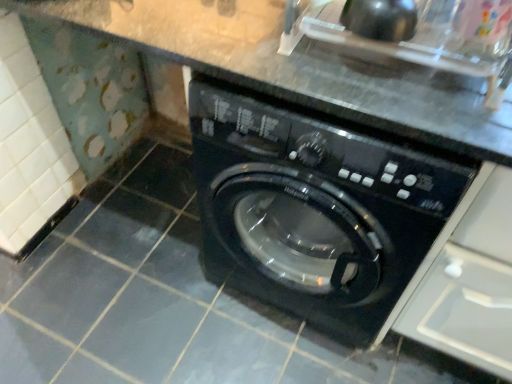
Question: From the image's perspective, is white plastic drawer at upper right beneath black glossy sink at upper right?

Choices:
 (A) yes
 (B) no

Answer: (A)

Question: Does white plastic drawer at upper right have a greater width compared to black glossy sink at upper right?

Choices:
 (A) yes
 (B) no

Answer: (A)

Question: Does white plastic drawer at upper right have a lesser height compared to black glossy sink at upper right?

Choices:
 (A) no
 (B) yes

Answer: (A)

Question: From a real-world perspective, is white plastic drawer at upper right positioned under black glossy sink at upper right based on gravity?

Choices:
 (A) no
 (B) yes

Answer: (B)

Question: Considering the relative sizes of white plastic drawer at upper right and black glossy sink at upper right in the image provided, is white plastic drawer at upper right thinner than black glossy sink at upper right?

Choices:
 (A) no
 (B) yes

Answer: (A)

Question: Considering the positions of point (225, 119) and point (464, 288), is point (225, 119) closer or farther from the camera than point (464, 288)?

Choices:
 (A) farther
 (B) closer

Answer: (B)

Question: From the image's perspective, is black glossy washing machine at center positioned above or below white plastic drawer at upper right?

Choices:
 (A) above
 (B) below

Answer: (A)

Question: Looking at their shapes, would you say black glossy washing machine at center is wider or thinner than white plastic drawer at upper right?

Choices:
 (A) wide
 (B) thin

Answer: (A)

Question: In terms of height, does black glossy washing machine at center look taller or shorter compared to white plastic drawer at upper right?

Choices:
 (A) tall
 (B) short

Answer: (B)

Question: Do you think black glossy washing machine at center is within black glossy sink at upper right, or outside of it?

Choices:
 (A) outside
 (B) inside

Answer: (A)

Question: Considering the relative positions of black glossy washing machine at center and black glossy sink at upper right in the image provided, is black glossy washing machine at center to the left or to the right of black glossy sink at upper right?

Choices:
 (A) right
 (B) left

Answer: (B)

Question: In terms of size, does black glossy washing machine at center appear bigger or smaller than black glossy sink at upper right?

Choices:
 (A) big
 (B) small

Answer: (A)

Question: From the image's perspective, is black glossy washing machine at center positioned above or below black glossy sink at upper right?

Choices:
 (A) above
 (B) below

Answer: (B)

Question: In the image, is black glossy sink at upper right on the left side or the right side of white plastic drawer at upper right?

Choices:
 (A) left
 (B) right

Answer: (A)

Question: Is black glossy sink at upper right wider or thinner than white plastic drawer at upper right?

Choices:
 (A) thin
 (B) wide

Answer: (A)